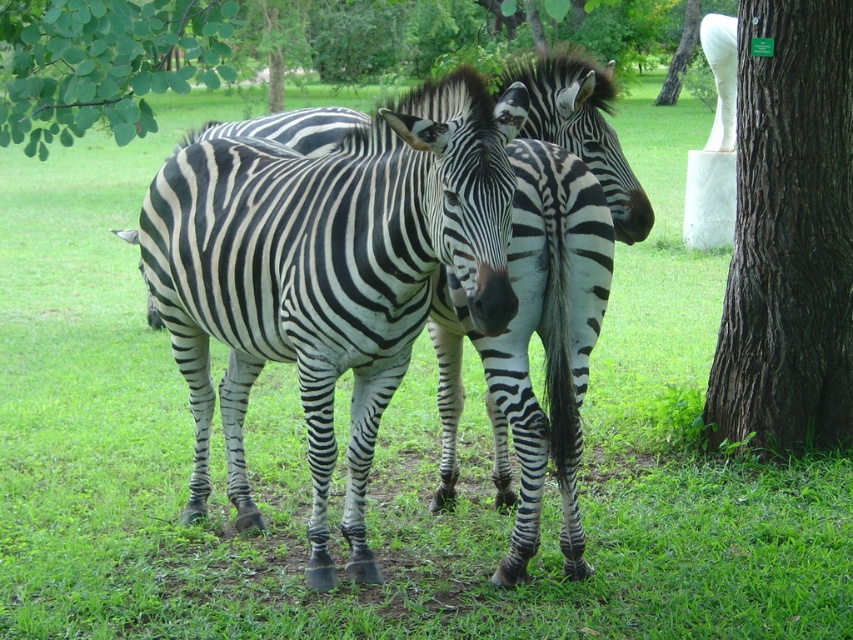
You are a photographer aiming to capture a photo of the black and white striped zebra at center and the white marble statue at upper right. Based on their positions, which object is positioned higher in the image?

The white marble statue at upper right is positioned higher in the image than the black and white striped zebra at center.

You are a photographer trying to capture both the black and white striped zebra at center and the white marble statue at upper right in the same frame. Given their sizes, which one should you focus on to ensure both fit in the photo?

The black and white striped zebra at center is bigger than the white marble statue at upper right. To ensure both fit in the photo, focus on the larger zebra at center, adjusting the camera angle to include the smaller statue at upper right.